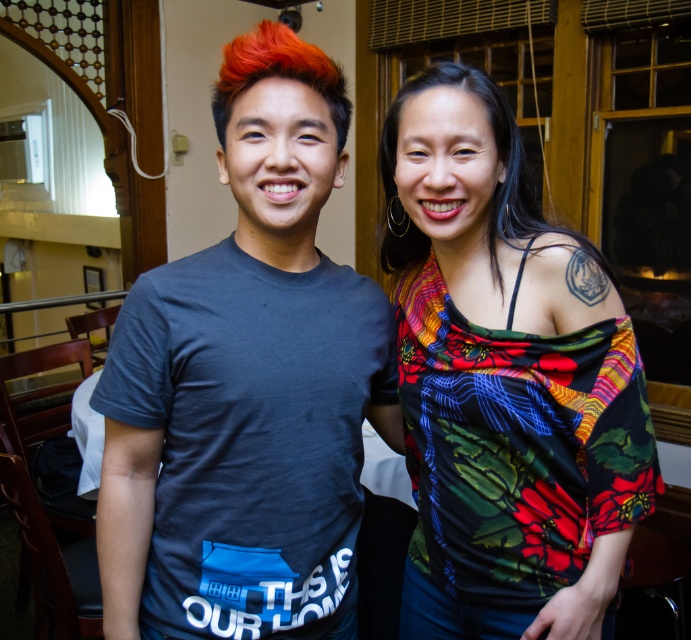
Is dark gray t-shirt at left to the left of black silky hair at upper right from the viewer's perspective?

Correct, you'll find dark gray t-shirt at left to the left of black silky hair at upper right.

Where is `dark gray t-shirt at left`? The image size is (691, 640). dark gray t-shirt at left is located at coordinates (247, 385).

Does point (131, 308) come farther from viewer compared to point (399, 253)?

No, (131, 308) is closer to viewer.

Identify the location of dark gray t-shirt at left. (247, 385).

Who is lower down, dark gray t-shirt at left or bright orange hair at center?

dark gray t-shirt at left is below.

Can you confirm if dark gray t-shirt at left is positioned above bright orange hair at center?

Incorrect, dark gray t-shirt at left is not positioned above bright orange hair at center.

Which is behind, point (252, 340) or point (227, 90)?

Positioned behind is point (227, 90).

Locate an element on the screen. dark gray t-shirt at left is located at coordinates coord(247,385).

Describe the element at coordinates (504, 380) in the screenshot. The width and height of the screenshot is (691, 640). I see `floral print top at center` at that location.

Between point (495, 84) and point (417, 230), which one is positioned in front?

Point (495, 84) is in front.

You are a GUI agent. You are given a task and a screenshot of the screen. Output one action in this format:
    pyautogui.click(x=<x>, y=<y>)
    Task: Click on the floral print top at center
    The width and height of the screenshot is (691, 640).
    Given the screenshot: What is the action you would take?
    pyautogui.click(x=504, y=380)